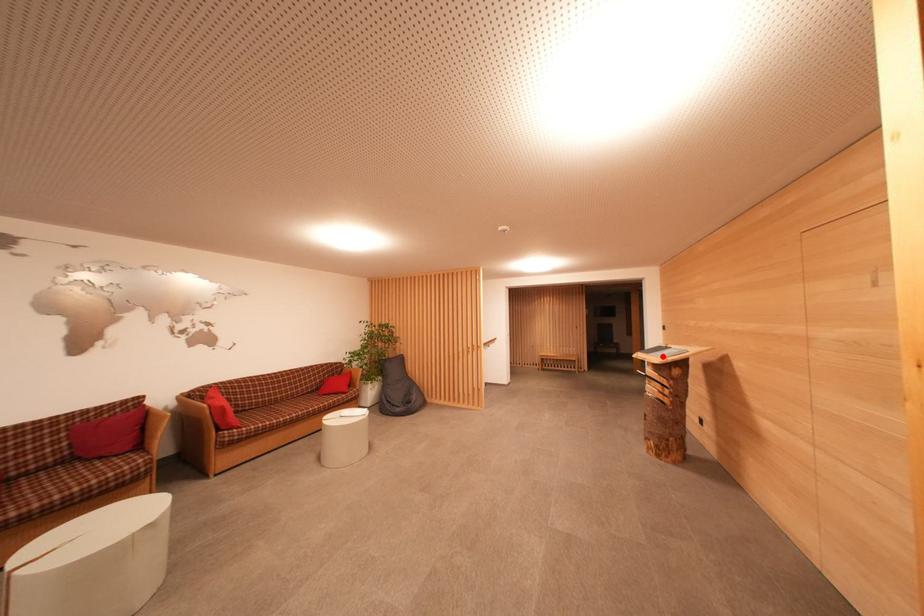
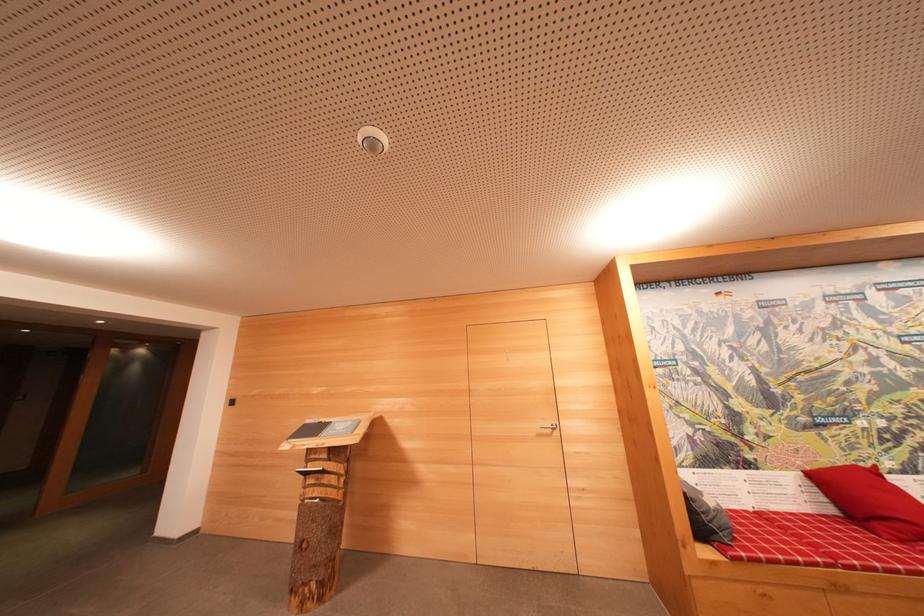
Where in the second image is the point corresponding to the highlighted location from the first image?

(330, 436)